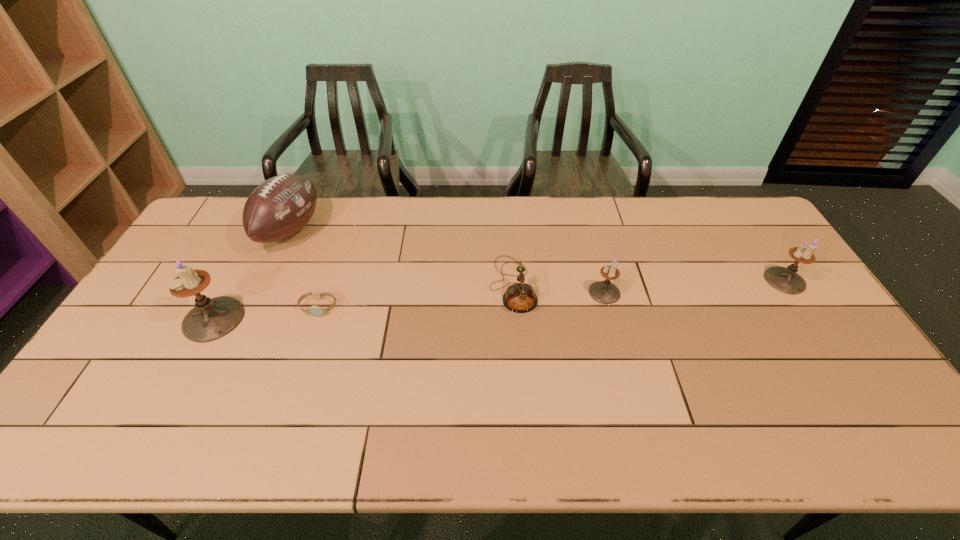
Locate an element on the screen. the fifth tallest object is located at coordinates (520, 297).

The image size is (960, 540). I want to click on vacant space located 0.220m on the back of the tallest candle holder, so click(x=252, y=247).

Find the location of a particular element. vacant area located 0.220m on the front of the shortest candle holder is located at coordinates (625, 369).

At what (x,y) coordinates should I click in order to perform the action: click on vacant space positioned on the back of the rightmost object. Please return your answer as a coordinate pair (x, y). Looking at the image, I should click on (756, 236).

You are a GUI agent. You are given a task and a screenshot of the screen. Output one action in this format:
    pyautogui.click(x=<x>, y=<y>)
    Task: Click on the free region located 0.320m on the front of the football (American)
    The height and width of the screenshot is (540, 960).
    Given the screenshot: What is the action you would take?
    pyautogui.click(x=239, y=342)

Where is `vacant point located on the face of the watch`? This screenshot has width=960, height=540. vacant point located on the face of the watch is located at coordinates (307, 343).

Identify the location of free space located on the rotary dial of the second shortest object. The height and width of the screenshot is (540, 960). (473, 285).

The width and height of the screenshot is (960, 540). Identify the location of vacant space located 0.180m on the rotary dial of the second shortest object. (430, 285).

Identify the location of vacant space located on the rotary dial of the second shortest object. The height and width of the screenshot is (540, 960). (400, 285).

Locate an element on the screen. object at the far edge is located at coordinates (281, 206).